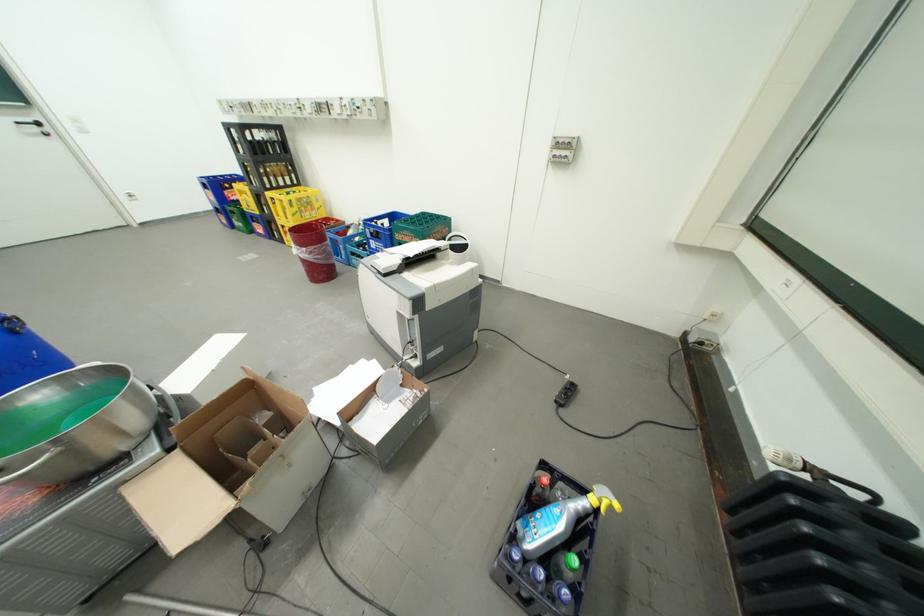
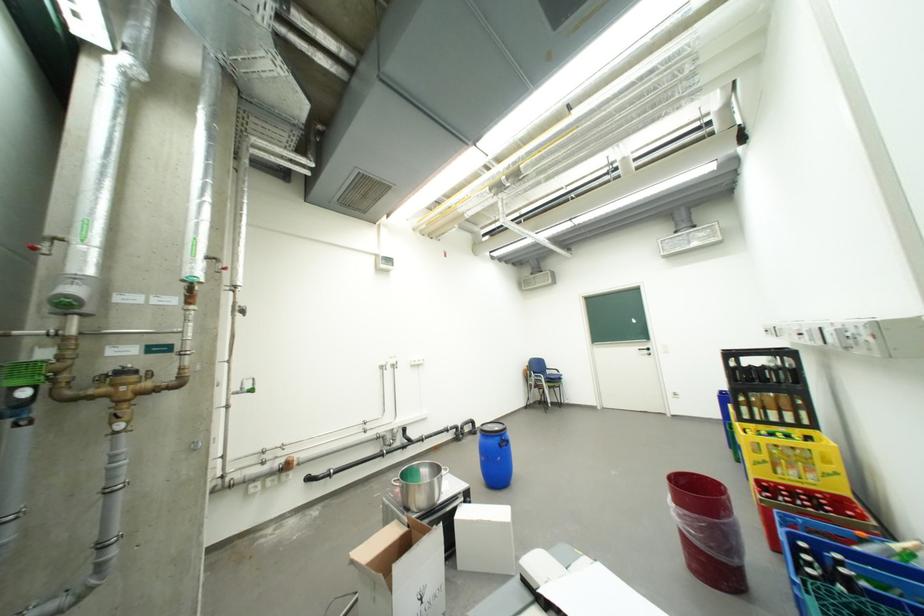
Locate, in the second image, the point that corresponds to (x=314, y=249) in the first image.

(685, 507)